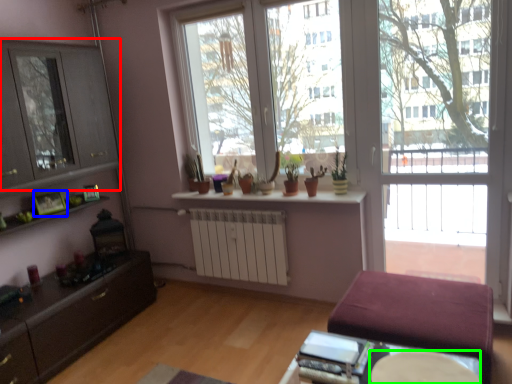
Question: Which object is positioned closest to cabinet (highlighted by a red box)? Select from picture frame (highlighted by a blue box) and round table (highlighted by a green box).

Choices:
 (A) picture frame
 (B) round table

Answer: (A)